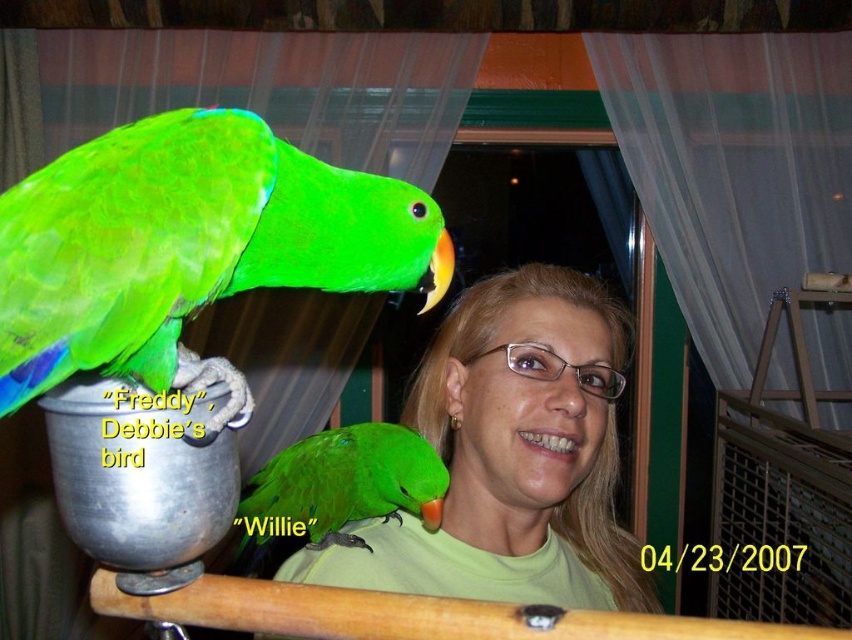
The woman is wearing a matte green shirt at center and has a green matte parrot at shoulder. Which object has a smaller height?

The matte green shirt at center has a lesser height compared to the green matte parrot at shoulder, so the matte green shirt at center is smaller in height.

You are a photographer trying to take a clear photo of the matte green shirt at center. However, the green matte parrot at upper left is blocking your view. Can you move the parrot to the side so that the shirt is visible?

The green matte parrot at upper left is in front of the matte green shirt at center, so moving the parrot to the side would allow the shirt to be visible.